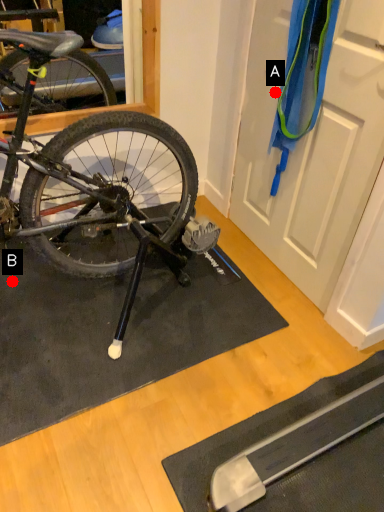
Question: Two points are circled on the image, labeled by A and B beside each circle. Which point is closer to the camera?

Choices:
 (A) A is closer
 (B) B is closer

Answer: (A)